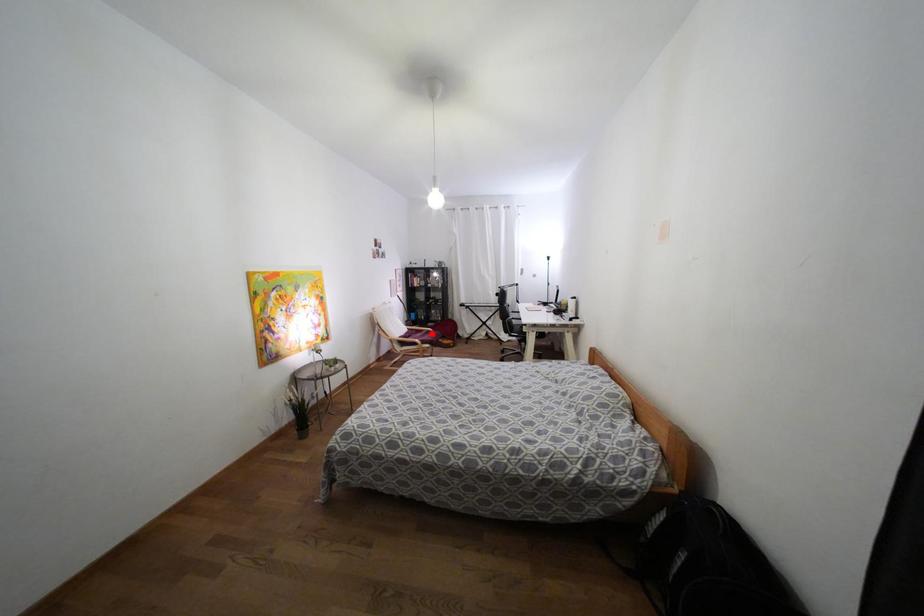
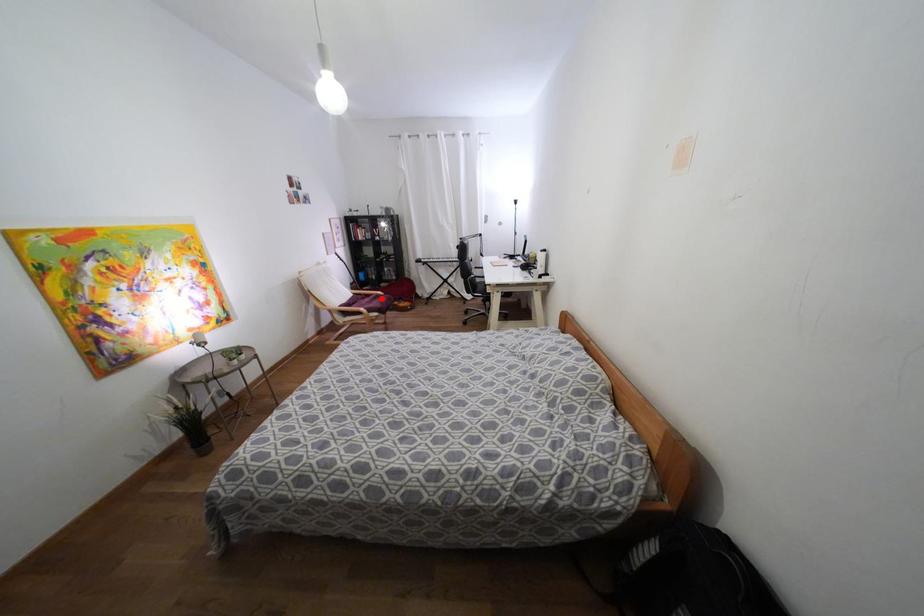
From the picture: I am providing you with two images of the same scene from different viewpoints. A red point is marked on the first image and another point is marked on the second image. Are the points marked in image1 and image2 representing the same 3D position?

Yes